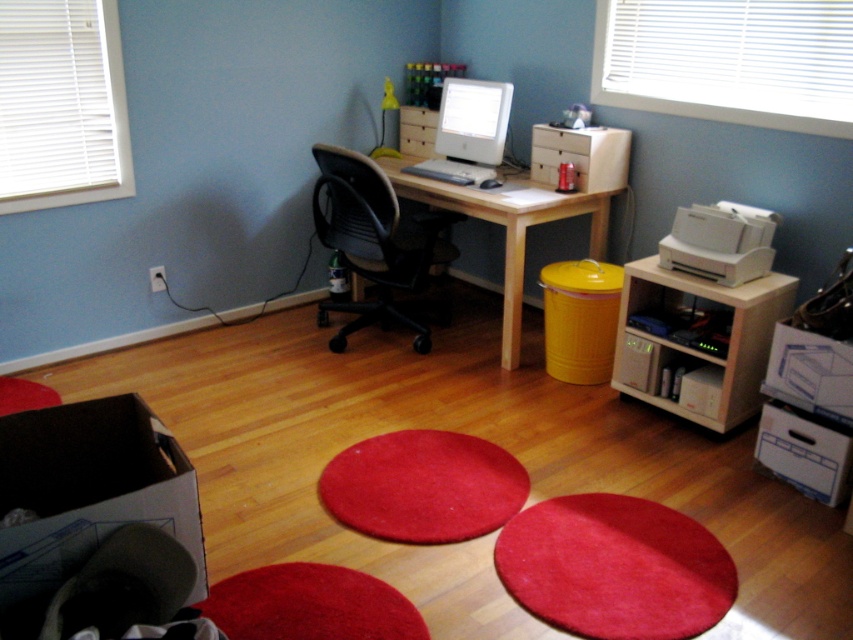
Question: Which object is positioned farthest from the black mesh swivel chair at center?

Choices:
 (A) velvety red rug at center
 (B) white glossy desktop computer at center
 (C) red plush rug at lower center

Answer: (C)

Question: Does black mesh swivel chair at center have a smaller size compared to white plastic printer at right?

Choices:
 (A) no
 (B) yes

Answer: (A)

Question: Can you confirm if yellow matte trash can at lower center is positioned to the left of white glossy desktop computer at center?

Choices:
 (A) yes
 (B) no

Answer: (B)

Question: Among these objects, which one is nearest to the camera?

Choices:
 (A) shiny red rug at lower center
 (B) yellow matte trash can at lower center
 (C) white plastic printer at right

Answer: (A)

Question: Where is black mesh swivel chair at center located in relation to red plush rug at lower center in the image?

Choices:
 (A) below
 (B) above

Answer: (B)

Question: Based on their relative distances, which object is nearer to the velvety red rug at lower center?

Choices:
 (A) white glossy desktop computer at center
 (B) black mesh swivel chair at center
 (C) velvety red rug at center

Answer: (C)